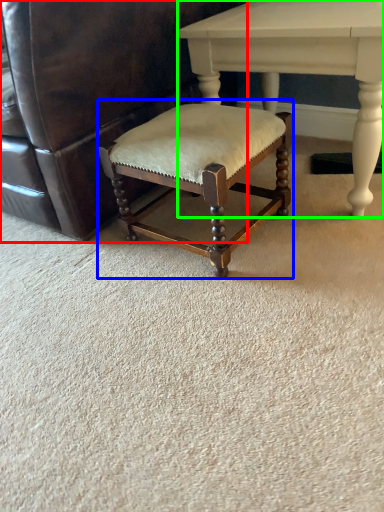
Question: Which is farther away from chair (highlighted by a red box)? bar stool (highlighted by a blue box) or table (highlighted by a green box)?

Choices:
 (A) bar stool
 (B) table

Answer: (B)